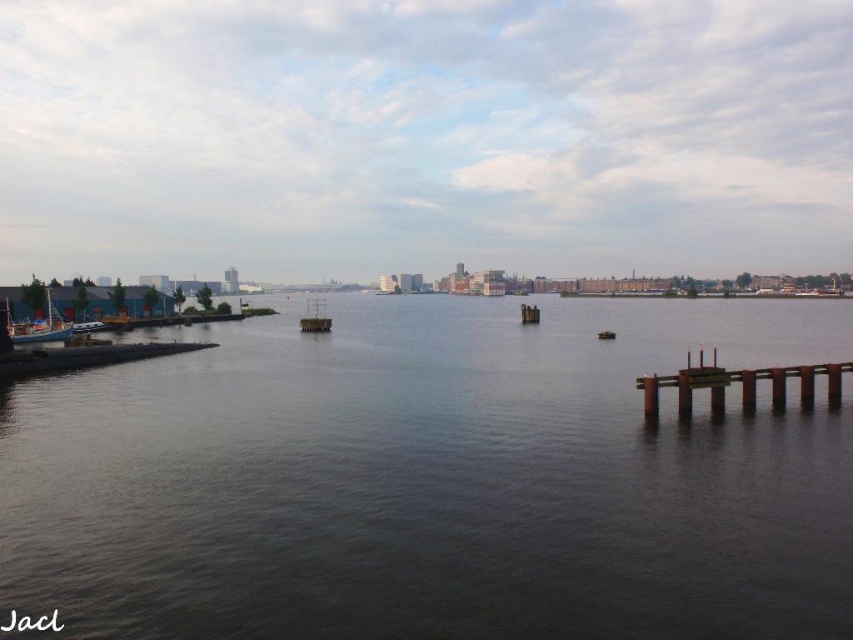
Question: Is brown wooden dock at right behind wooden boat at left?

Choices:
 (A) no
 (B) yes

Answer: (A)

Question: Which of the following is the closest to the observer?

Choices:
 (A) (689, 406)
 (B) (305, 317)
 (C) (61, 337)

Answer: (A)

Question: Among these objects, which one is nearest to the camera?

Choices:
 (A) metallic grid at center
 (B) brown wooden dock at right

Answer: (B)

Question: Can you confirm if brown wooden dock at right is thinner than wooden boat at left?

Choices:
 (A) no
 (B) yes

Answer: (B)

Question: Does dark water at center appear under brown wooden dock at right?

Choices:
 (A) yes
 (B) no

Answer: (B)

Question: Which object is the closest to the brown wooden dock at right?

Choices:
 (A) wooden boat at left
 (B) dark water at center

Answer: (B)